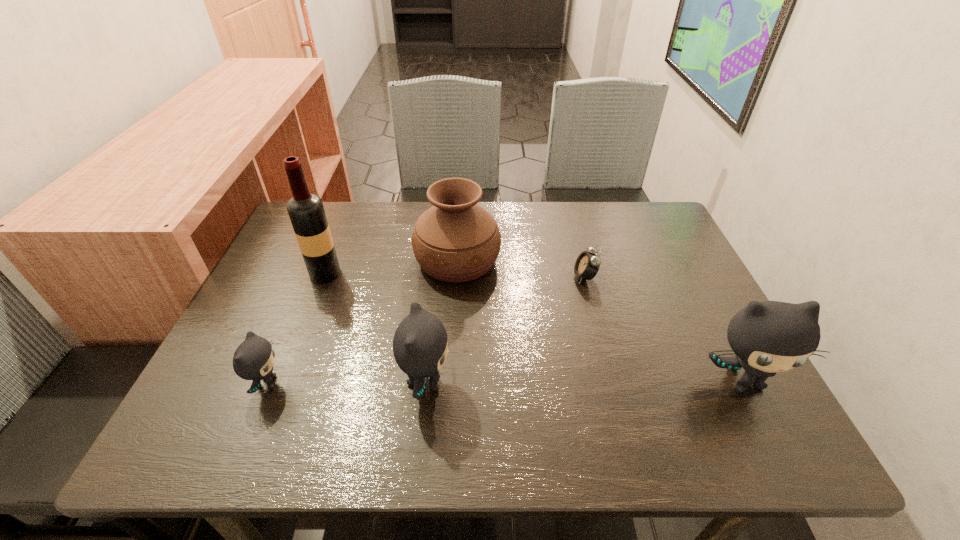
Select which kitten is the second closest to the shortest object. Please provide its 2D coordinates. Your answer should be formatted as a tuple, i.e. [(x, y)], where the tuple contains the x and y coordinates of a point satisfying the conditions above.

[(420, 349)]

Locate which kitten ranks in proximity to the wine bottle. Please provide its 2D coordinates. Your answer should be formatted as a tuple, i.e. [(x, y)], where the tuple contains the x and y coordinates of a point satisfying the conditions above.

[(254, 358)]

Find the location of a particular element. free spot that satisfies the following two spatial constraints: 1. on the back side of the urn; 2. on the right side of the tallest object is located at coordinates (330, 260).

You are a GUI agent. You are given a task and a screenshot of the screen. Output one action in this format:
    pyautogui.click(x=<x>, y=<y>)
    Task: Click on the free space that satisfies the following two spatial constraints: 1. on the front-facing side of the rightmost object; 2. on the front-facing side of the shortest kitten
    
    Given the screenshot: What is the action you would take?
    pyautogui.click(x=744, y=383)